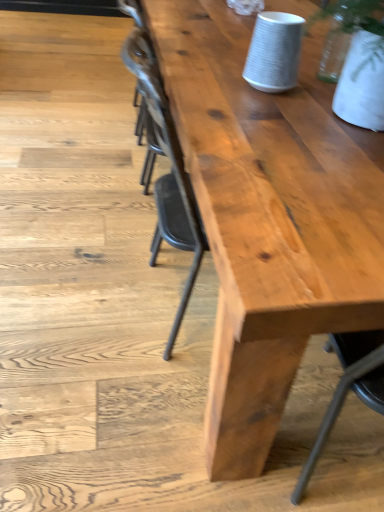
The width and height of the screenshot is (384, 512). I want to click on natural wood table at center, so click(266, 223).

The width and height of the screenshot is (384, 512). Describe the element at coordinates (266, 223) in the screenshot. I see `natural wood table at center` at that location.

Identify the location of natural wood table at center. The width and height of the screenshot is (384, 512). (266, 223).